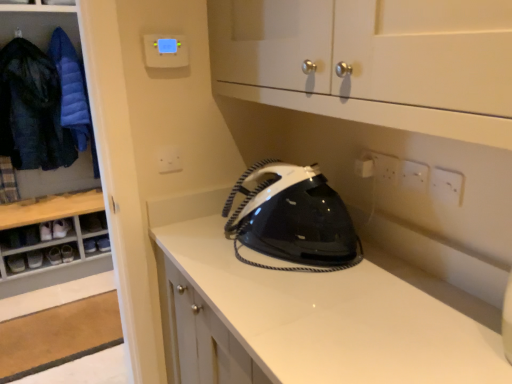
Question: Considering the positions of dark blue quilted jacket at left, the first clothing in the left-to-right sequence, and blue down jacket at left, which appears as the first clothing when viewed from the right, in the image, is dark blue quilted jacket at left, the first clothing in the left-to-right sequence, bigger or smaller than blue down jacket at left, which appears as the first clothing when viewed from the right,?

Choices:
 (A) big
 (B) small

Answer: (A)

Question: In terms of width, does dark blue quilted jacket at left, the first clothing in the left-to-right sequence, look wider or thinner when compared to blue down jacket at left, positioned as the second clothing in left-to-right order?

Choices:
 (A) wide
 (B) thin

Answer: (A)

Question: Based on their relative distances, which object is nearer to the wooden dresser at left?

Choices:
 (A) white fabric shoe at lower left, which is the 5th footwear in bottom-to-top order
 (B) black glossy iron at center
 (C) white leather shoe at lower left, placed as the fourth footwear when sorted from bottom to top
 (D) white plastic electric outlet at center, which is counted as the 1th electric outlet, starting from the back
 (E) black leather shoe at lower left, the 1th footwear ordered from the bottom

Answer: (A)

Question: Which is nearer to the black leather shoe at lower left, the 5th footwear positioned from the top?

Choices:
 (A) white plastic electric outlet at center, the first electric outlet from the left
 (B) black glossy iron at center
 (C) wooden dresser at left
 (D) white plastic electric outlet at upper right, which is counted as the second electric outlet, starting from the back
 (E) white leather shoe at lower left, placed as the fourth footwear when sorted from bottom to top

Answer: (E)